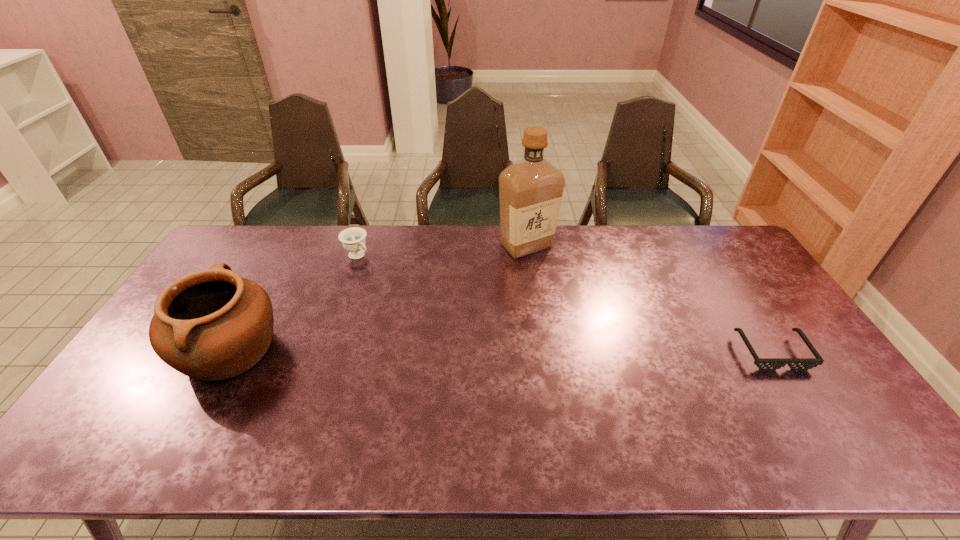
The height and width of the screenshot is (540, 960). Find the location of `pottery`. pottery is located at coordinates (212, 324).

I want to click on the leftmost object, so click(x=212, y=324).

At what (x,y) coordinates should I click in order to perform the action: click on the rightmost object. Please return your answer as a coordinate pair (x, y). This screenshot has height=540, width=960. Looking at the image, I should click on (764, 364).

This screenshot has height=540, width=960. I want to click on the shortest object, so click(764, 364).

Locate an element on the screen. the tallest object is located at coordinates (530, 190).

Where is `the second object from right to left`? The image size is (960, 540). the second object from right to left is located at coordinates pos(530,190).

This screenshot has width=960, height=540. Find the location of `the second shortest object`. the second shortest object is located at coordinates (353, 239).

I want to click on the third object from right to left, so click(353, 239).

You are a GUI agent. You are given a task and a screenshot of the screen. Output one action in this format:
    pyautogui.click(x=<x>, y=<y>)
    Task: Click on the free space located on the right of the leftmost object
    The width and height of the screenshot is (960, 540).
    Given the screenshot: What is the action you would take?
    pyautogui.click(x=318, y=350)

I want to click on free space located on the front-facing side of the rightmost object, so click(801, 396).